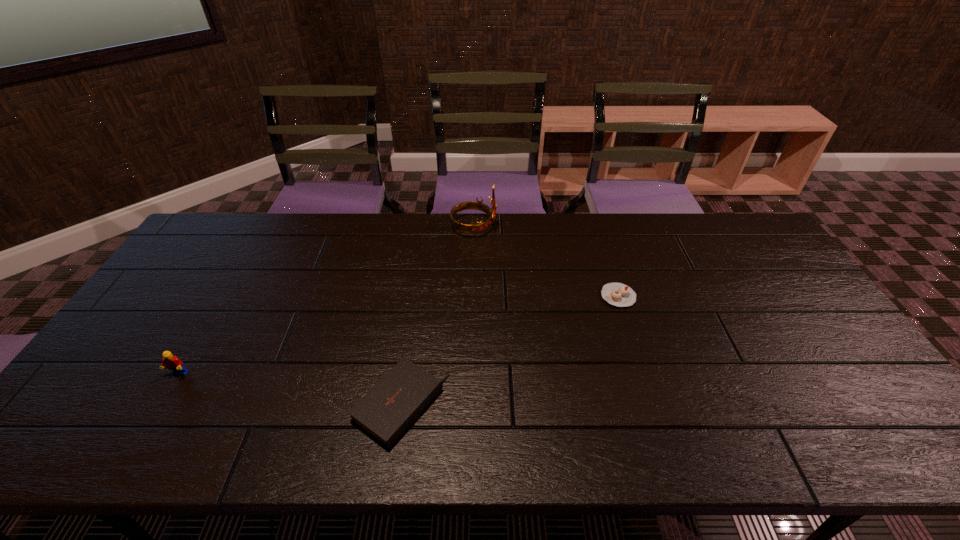
The height and width of the screenshot is (540, 960). In order to click on tiara in this screenshot , I will do `click(480, 226)`.

Find the location of a particular element. the tallest object is located at coordinates (480, 226).

Where is `the third shortest object`? This screenshot has width=960, height=540. the third shortest object is located at coordinates (172, 362).

Identify the location of Lego. (172, 362).

The width and height of the screenshot is (960, 540). Identify the location of the third nearest object. (617, 294).

Identify the location of the rightmost object. (617, 294).

Find the location of a particular element. This screenshot has width=960, height=540. Bible is located at coordinates [x=385, y=412].

Where is `free region located on the front-facing side of the farthest object`? This screenshot has width=960, height=540. free region located on the front-facing side of the farthest object is located at coordinates (516, 227).

Where is `vacant space located on the front-facing side of the Lego`? vacant space located on the front-facing side of the Lego is located at coordinates (x=135, y=448).

You are a GUI agent. You are given a task and a screenshot of the screen. Output one action in this format:
    pyautogui.click(x=<x>, y=<y>)
    Task: Click on the free space located 0.340m on the back of the rightmost object
    This screenshot has height=540, width=960.
    Given the screenshot: What is the action you would take?
    pyautogui.click(x=594, y=220)